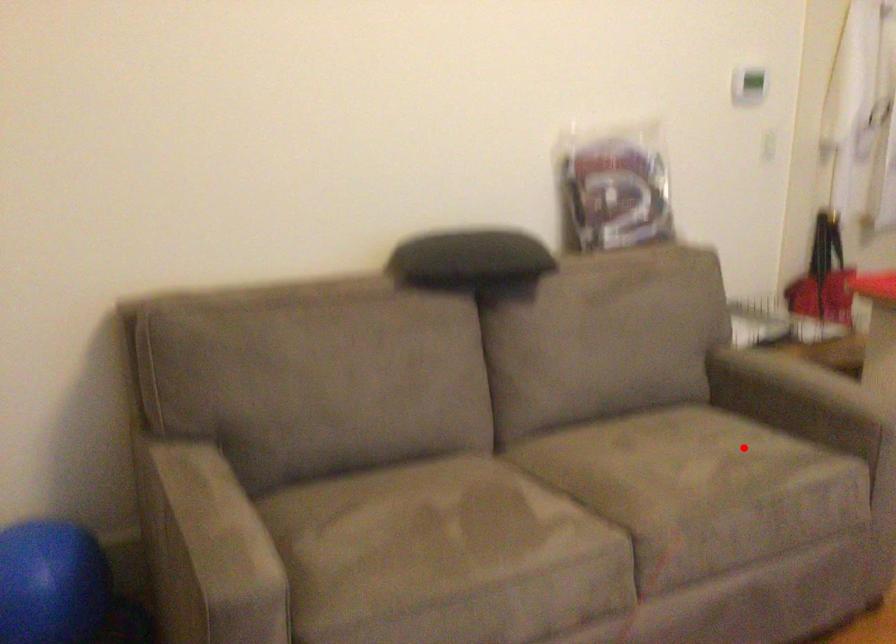
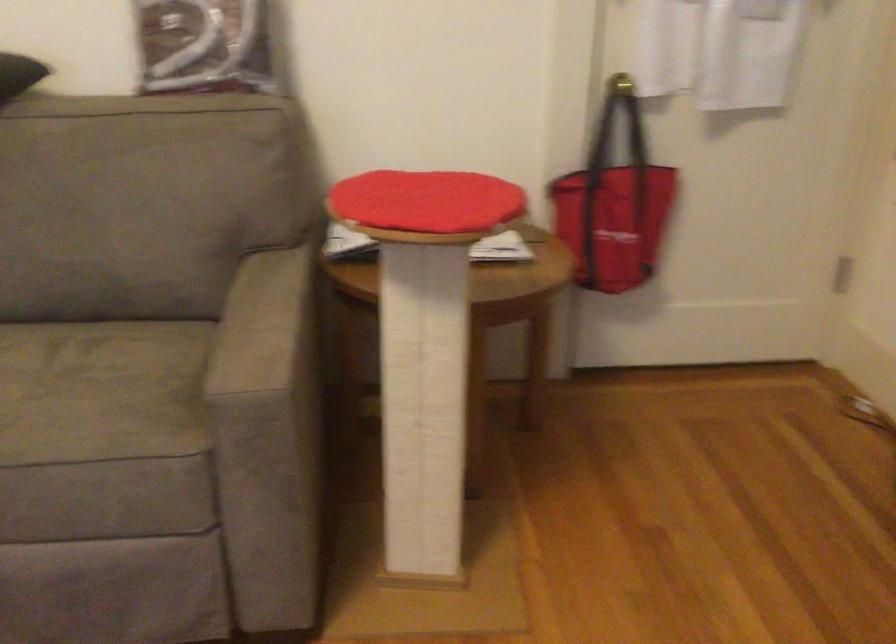
Question: I am providing you with two images of the same scene from different viewpoints. A red point is shown in image1. For the corresponding object point in image2, is it positioned nearer or farther from the camera?

Choices:
 (A) Nearer
 (B) Farther

Answer: (A)